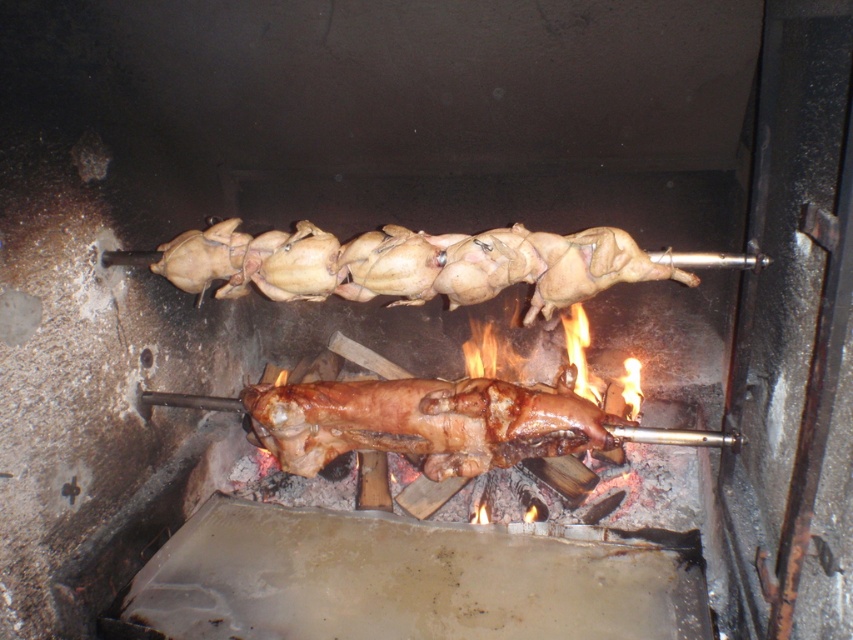
Question: Is golden brown chicken at center positioned at the back of brown crispy pig at center?

Choices:
 (A) yes
 (B) no

Answer: (B)

Question: Is golden brown chicken at center behind brown crispy pig at center?

Choices:
 (A) yes
 (B) no

Answer: (B)

Question: Is golden brown chicken at center behind brown crispy pig at center?

Choices:
 (A) no
 (B) yes

Answer: (A)

Question: Among these objects, which one is farthest from the camera?

Choices:
 (A) golden brown chicken at center
 (B) brown crispy pig at center

Answer: (B)

Question: Among these objects, which one is farthest from the camera?

Choices:
 (A) golden brown chicken at center
 (B) brown crispy pig at center

Answer: (B)